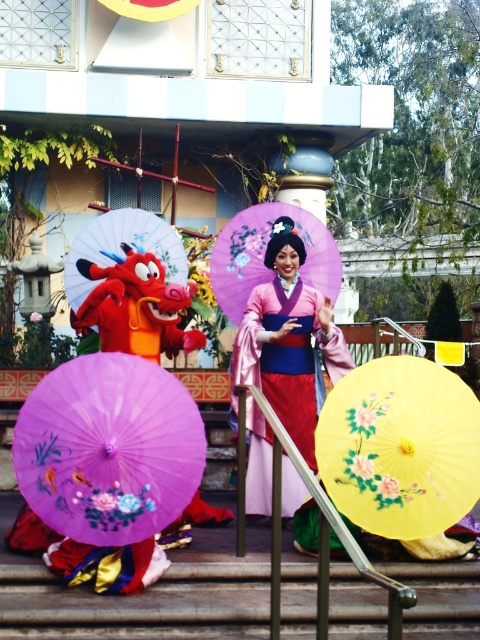
You are a photographer positioned in front of the scene. You need to capture a photo where the pink satin kimono at center and the matte purple parasol at center are both clearly visible. Based on their positions, which object should you ensure is placed closer to the left side of the frame to avoid cropping?

The matte purple parasol at center should be placed closer to the left side of the frame because the pink satin kimono at center is positioned to the right of the matte purple parasol at center, so moving the parasol left ensures both are visible without cropping.

You are a photographer trying to capture a clear shot of both the yellow paper umbrella at center and the purple painted parasol at center. Since you want to focus on the details of the smaller object, which one should you zoom in on?

The yellow paper umbrella at center is thinner than the purple painted parasol at center, so you should zoom in on the yellow paper umbrella at center as it is the smaller object.